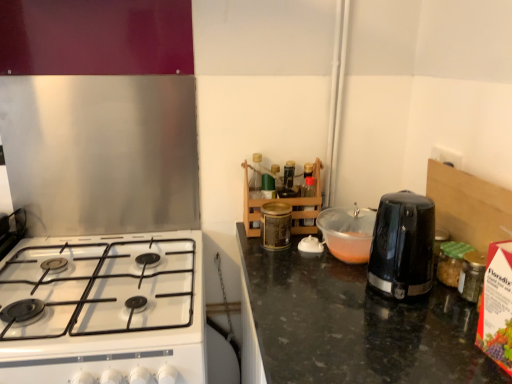
In order to face white glossy gas stove at lower left, should I rotate leftwards or rightwards?

Rotate left and turn 20.916 degrees.

Measure the distance between white glossy gas stove at lower left and camera.

white glossy gas stove at lower left is 36.50 inches away from camera.

Describe the element at coordinates (347, 233) in the screenshot. I see `black plastic toaster at center-right, which appears as the 2th kitchen appliance when viewed from the left` at that location.

In order to face black plastic kettle at right, arranged as the 1th kitchen appliance when viewed from the right, should I rotate leftwards or rightwards?

Turn right by 19.148 degrees to look at black plastic kettle at right, arranged as the 1th kitchen appliance when viewed from the right.

Identify the location of gold metallic canister at center, which ranks as the 3th kitchen appliance in right-to-left order. (276, 225).

Measure the distance between point (283, 217) and camera.

Point (283, 217) and camera are 4.20 feet apart.

Find the location of a particular element. white glossy gas stove at lower left is located at coordinates (101, 286).

Is white glossy gas stove at lower left positioned before black plastic kettle at right, arranged as the 1th kitchen appliance when viewed from the right?

That is True.

Looking at this image, which of these two, white glossy gas stove at lower left or black plastic kettle at right, which appears as the 3th kitchen appliance when viewed from the left, is bigger?

With larger size is white glossy gas stove at lower left.

Considering the relative sizes of white glossy gas stove at lower left and black plastic kettle at right, arranged as the 1th kitchen appliance when viewed from the right, in the image provided, is white glossy gas stove at lower left shorter than black plastic kettle at right, arranged as the 1th kitchen appliance when viewed from the right,?

Yes, white glossy gas stove at lower left is shorter than black plastic kettle at right, arranged as the 1th kitchen appliance when viewed from the right.

Find the location of a particular element. This screenshot has width=512, height=384. gas stove that is in front of the black plastic kettle at right, which appears as the 3th kitchen appliance when viewed from the left is located at coordinates (101, 286).

Are black plastic kettle at right, which appears as the 3th kitchen appliance when viewed from the left, and wooden rack at center far apart?

No, black plastic kettle at right, which appears as the 3th kitchen appliance when viewed from the left, is not far from wooden rack at center.

Based on the photo, relative to wooden rack at center, is black plastic kettle at right, arranged as the 1th kitchen appliance when viewed from the right, in front or behind?

Visually, black plastic kettle at right, arranged as the 1th kitchen appliance when viewed from the right, is located in front of wooden rack at center.

Considering the sizes of objects black plastic kettle at right, arranged as the 1th kitchen appliance when viewed from the right, and wooden rack at center in the image provided, who is thinner, black plastic kettle at right, arranged as the 1th kitchen appliance when viewed from the right, or wooden rack at center?

With smaller width is black plastic kettle at right, arranged as the 1th kitchen appliance when viewed from the right.

Is wooden rack at center a part of black plastic kettle at right, which appears as the 3th kitchen appliance when viewed from the left?

No, wooden rack at center is located outside of black plastic kettle at right, which appears as the 3th kitchen appliance when viewed from the left.

Between point (348, 232) and point (84, 264), which one is positioned behind?

The point (84, 264) is behind.

In the scene shown: Is black plastic toaster at center-right, which appears as the 2th kitchen appliance when viewed from the left, to the left of white glossy gas stove at lower left from the viewer's perspective?

No, black plastic toaster at center-right, which appears as the 2th kitchen appliance when viewed from the left, is not to the left of white glossy gas stove at lower left.

How much distance is there between black plastic toaster at center-right, which appears as the 2th kitchen appliance when viewed from the left, and white glossy gas stove at lower left?

black plastic toaster at center-right, which appears as the 2th kitchen appliance when viewed from the left, is 23.86 inches from white glossy gas stove at lower left.

From a real-world perspective, is black plastic toaster at center-right, acting as the 2th kitchen appliance starting from the right, positioned under white glossy gas stove at lower left based on gravity?

No, from a real-world perspective, black plastic toaster at center-right, acting as the 2th kitchen appliance starting from the right, is not beneath white glossy gas stove at lower left.

Considering the sizes of black plastic toaster at center-right, acting as the 2th kitchen appliance starting from the right, and black plastic kettle at right, which appears as the 3th kitchen appliance when viewed from the left, in the image, is black plastic toaster at center-right, acting as the 2th kitchen appliance starting from the right, taller or shorter than black plastic kettle at right, which appears as the 3th kitchen appliance when viewed from the left,?

Clearly, black plastic toaster at center-right, acting as the 2th kitchen appliance starting from the right, is shorter compared to black plastic kettle at right, which appears as the 3th kitchen appliance when viewed from the left.

Considering the relative sizes of black plastic toaster at center-right, acting as the 2th kitchen appliance starting from the right, and black plastic kettle at right, arranged as the 1th kitchen appliance when viewed from the right, in the image provided, is black plastic toaster at center-right, acting as the 2th kitchen appliance starting from the right, smaller than black plastic kettle at right, arranged as the 1th kitchen appliance when viewed from the right,?

Indeed, black plastic toaster at center-right, acting as the 2th kitchen appliance starting from the right, has a smaller size compared to black plastic kettle at right, arranged as the 1th kitchen appliance when viewed from the right.

Between black plastic toaster at center-right, acting as the 2th kitchen appliance starting from the right, and black plastic kettle at right, which appears as the 3th kitchen appliance when viewed from the left, which one is positioned behind?

black plastic toaster at center-right, acting as the 2th kitchen appliance starting from the right, is further from the camera.

From the picture: From a real-world perspective, is black plastic toaster at center-right, which appears as the 2th kitchen appliance when viewed from the left, below black plastic kettle at right, arranged as the 1th kitchen appliance when viewed from the right?

Yes, from a real-world perspective, black plastic toaster at center-right, which appears as the 2th kitchen appliance when viewed from the left, is below black plastic kettle at right, arranged as the 1th kitchen appliance when viewed from the right.

Is black plastic kettle at right, which appears as the 3th kitchen appliance when viewed from the left, shorter than gold metallic canister at center, which ranks as the 3th kitchen appliance in right-to-left order?

No.

Do you think black plastic kettle at right, arranged as the 1th kitchen appliance when viewed from the right, is within gold metallic canister at center, which appears as the 1th kitchen appliance when viewed from the left, or outside of it?

black plastic kettle at right, arranged as the 1th kitchen appliance when viewed from the right, is spatially situated outside gold metallic canister at center, which appears as the 1th kitchen appliance when viewed from the left.

Is black plastic kettle at right, which appears as the 3th kitchen appliance when viewed from the left, thinner than gold metallic canister at center, which ranks as the 3th kitchen appliance in right-to-left order?

Incorrect, the width of black plastic kettle at right, which appears as the 3th kitchen appliance when viewed from the left, is not less than that of gold metallic canister at center, which ranks as the 3th kitchen appliance in right-to-left order.

From the image's perspective, is black plastic kettle at right, arranged as the 1th kitchen appliance when viewed from the right, positioned above or below gold metallic canister at center, which appears as the 1th kitchen appliance when viewed from the left?

Clearly, from the image's perspective, black plastic kettle at right, arranged as the 1th kitchen appliance when viewed from the right, is below gold metallic canister at center, which appears as the 1th kitchen appliance when viewed from the left.

Between wooden rack at center and gold metallic canister at center, which ranks as the 3th kitchen appliance in right-to-left order, which one has larger width?

With larger width is wooden rack at center.

Is wooden rack at center outside of gold metallic canister at center, which ranks as the 3th kitchen appliance in right-to-left order?

Yes, wooden rack at center is located beyond the bounds of gold metallic canister at center, which ranks as the 3th kitchen appliance in right-to-left order.

Could you tell me if wooden rack at center is facing gold metallic canister at center, which appears as the 1th kitchen appliance when viewed from the left?

No, wooden rack at center is not oriented towards gold metallic canister at center, which appears as the 1th kitchen appliance when viewed from the left.

What's the angular difference between white glossy gas stove at lower left and black plastic toaster at center-right, acting as the 2th kitchen appliance starting from the right,'s facing directions?

The facing directions of white glossy gas stove at lower left and black plastic toaster at center-right, acting as the 2th kitchen appliance starting from the right, are 90 degrees apart.

Is white glossy gas stove at lower left wider than black plastic toaster at center-right, acting as the 2th kitchen appliance starting from the right?

Correct, the width of white glossy gas stove at lower left exceeds that of black plastic toaster at center-right, acting as the 2th kitchen appliance starting from the right.

Can we say white glossy gas stove at lower left lies outside black plastic toaster at center-right, acting as the 2th kitchen appliance starting from the right?

white glossy gas stove at lower left lies outside black plastic toaster at center-right, acting as the 2th kitchen appliance starting from the right,'s area.

Which object is more forward, white glossy gas stove at lower left or black plastic toaster at center-right, acting as the 2th kitchen appliance starting from the right?

white glossy gas stove at lower left is more forward.

You are a GUI agent. You are given a task and a screenshot of the screen. Output one action in this format:
    pyautogui.click(x=<x>, y=<y>)
    Task: Click on the 1st kitchen appliance above the white glossy gas stove at lower left (from the image's perspective)
    
    Given the screenshot: What is the action you would take?
    pyautogui.click(x=402, y=245)

Locate an element on the screen. This screenshot has height=384, width=512. the 3rd kitchen appliance in front of the wooden rack at center, counting from the anchor's position is located at coordinates (402, 245).

Estimate the real-world distances between objects in this image. Which object is closer to white glossy gas stove at lower left, wooden rack at center or black plastic kettle at right, arranged as the 1th kitchen appliance when viewed from the right?

wooden rack at center is positioned closer to the anchor white glossy gas stove at lower left.

From the image, which object appears to be nearer to black plastic kettle at right, arranged as the 1th kitchen appliance when viewed from the right, gold metallic canister at center, which appears as the 1th kitchen appliance when viewed from the left, or black plastic toaster at center-right, which appears as the 2th kitchen appliance when viewed from the left?

Based on the image, black plastic toaster at center-right, which appears as the 2th kitchen appliance when viewed from the left, appears to be nearer to black plastic kettle at right, arranged as the 1th kitchen appliance when viewed from the right.

From the image, which object appears to be nearer to gold metallic canister at center, which appears as the 1th kitchen appliance when viewed from the left, black plastic toaster at center-right, which appears as the 2th kitchen appliance when viewed from the left, or wooden rack at center?

wooden rack at center lies closer to gold metallic canister at center, which appears as the 1th kitchen appliance when viewed from the left, than the other object.

Looking at the image, which one is located closer to gold metallic canister at center, which appears as the 1th kitchen appliance when viewed from the left, black plastic toaster at center-right, acting as the 2th kitchen appliance starting from the right, or black plastic kettle at right, which appears as the 3th kitchen appliance when viewed from the left?

black plastic toaster at center-right, acting as the 2th kitchen appliance starting from the right, lies closer to gold metallic canister at center, which appears as the 1th kitchen appliance when viewed from the left, than the other object.

Looking at the image, which one is located further to white glossy gas stove at lower left, black plastic toaster at center-right, which appears as the 2th kitchen appliance when viewed from the left, or black plastic kettle at right, which appears as the 3th kitchen appliance when viewed from the left?

black plastic kettle at right, which appears as the 3th kitchen appliance when viewed from the left, is further to white glossy gas stove at lower left.

Estimate the real-world distances between objects in this image. Which object is further from black plastic toaster at center-right, which appears as the 2th kitchen appliance when viewed from the left, white glossy gas stove at lower left or black plastic kettle at right, arranged as the 1th kitchen appliance when viewed from the right?

white glossy gas stove at lower left.

In the scene shown: When comparing their distances from gold metallic canister at center, which ranks as the 3th kitchen appliance in right-to-left order, does wooden rack at center or black plastic toaster at center-right, which appears as the 2th kitchen appliance when viewed from the left, seem further?

The object further to gold metallic canister at center, which ranks as the 3th kitchen appliance in right-to-left order, is black plastic toaster at center-right, which appears as the 2th kitchen appliance when viewed from the left.

When comparing their distances from black plastic kettle at right, arranged as the 1th kitchen appliance when viewed from the right, does wooden rack at center or white glossy gas stove at lower left seem closer?

wooden rack at center is positioned closer to the anchor black plastic kettle at right, arranged as the 1th kitchen appliance when viewed from the right.

The image size is (512, 384). Find the location of `kitchen appliance located between white glossy gas stove at lower left and black plastic toaster at center-right, acting as the 2th kitchen appliance starting from the right, in the left-right direction`. kitchen appliance located between white glossy gas stove at lower left and black plastic toaster at center-right, acting as the 2th kitchen appliance starting from the right, in the left-right direction is located at coordinates (276, 225).

Locate an element on the screen. The image size is (512, 384). shelf between gold metallic canister at center, which ranks as the 3th kitchen appliance in right-to-left order, and black plastic toaster at center-right, which appears as the 2th kitchen appliance when viewed from the left, in the horizontal direction is located at coordinates (284, 202).

Identify the location of shelf between white glossy gas stove at lower left and black plastic kettle at right, which appears as the 3th kitchen appliance when viewed from the left. (284, 202).

This screenshot has width=512, height=384. What are the coordinates of `kitchen appliance between black plastic kettle at right, which appears as the 3th kitchen appliance when viewed from the left, and gold metallic canister at center, which ranks as the 3th kitchen appliance in right-to-left order, along the z-axis` in the screenshot? It's located at (347, 233).